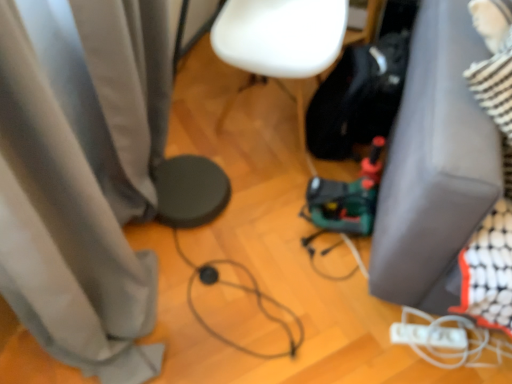
Image resolution: width=512 pixels, height=384 pixels. What are the coordinates of `vacant space that is in between white matte wii controller at lower right and black cable at center` in the screenshot? It's located at (338, 336).